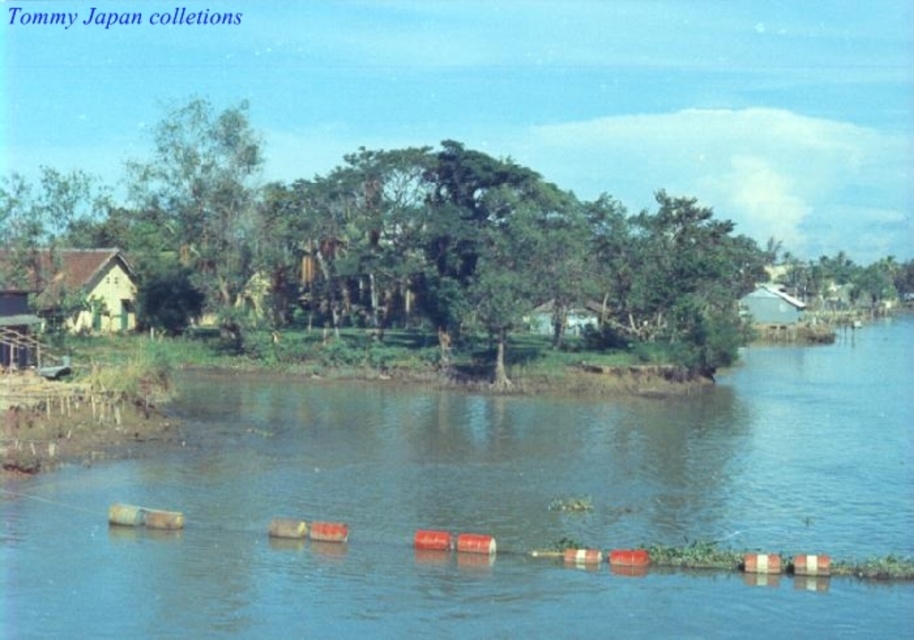
Question: Which of the following is the farthest from the observer?

Choices:
 (A) white matte hut at upper right
 (B) green leafy tree at center
 (C) smooth concrete river at center

Answer: (A)

Question: Is yellow matte hut at left wider than green leafy tree at upper right?

Choices:
 (A) no
 (B) yes

Answer: (A)

Question: Which object is closer to the camera taking this photo?

Choices:
 (A) green leafy tree at upper right
 (B) white matte hut at upper right

Answer: (B)

Question: Which object is farther from the camera taking this photo?

Choices:
 (A) yellow matte hut at left
 (B) green leafy tree at center

Answer: (B)

Question: Can you confirm if smooth concrete river at center is bigger than yellow matte hut at left?

Choices:
 (A) no
 (B) yes

Answer: (B)

Question: Is smooth concrete river at center below yellow matte hut at left?

Choices:
 (A) yes
 (B) no

Answer: (A)